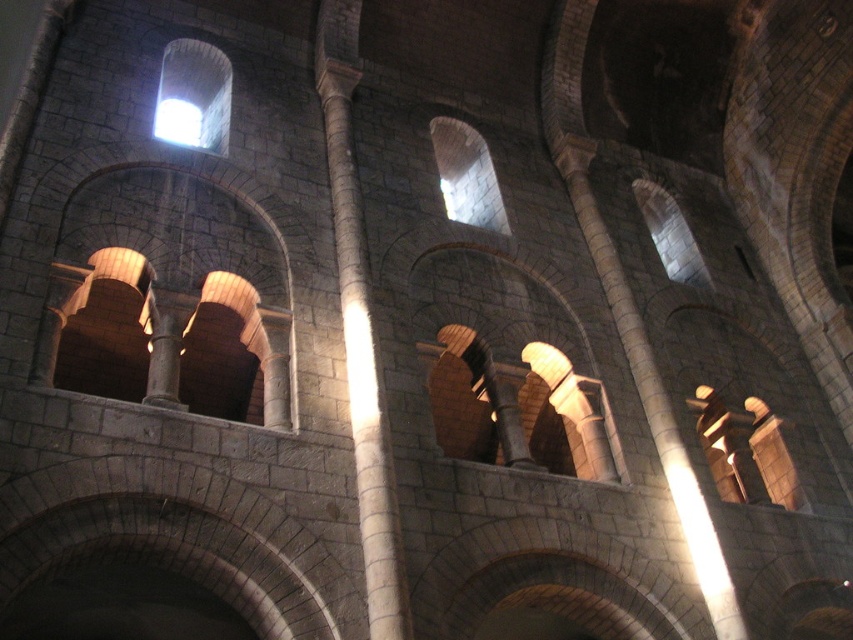
You are an architect examining the interior of a historic stone structure. You notice the smooth stone column at center and the white glossy light at upper center. Based on their positions, which object is closer to the right side of the structure?

The smooth stone column at center is to the right of the white glossy light at upper center, so the smooth stone column at center is closer to the right side of the structure.

You are an architect assessing the structural integrity of the historic stone structure. You notice the smooth stone column at center and the white glossy light at upper center. Which object has a greater width?

The smooth stone column at center has a greater width than the white glossy light at upper center according to the description.

You are standing in the historic stone structure and want to locate the smooth stone column at center. According to the coordinates provided, where should you look to find it?

The smooth stone column at center is located at coordinates point (360,326).